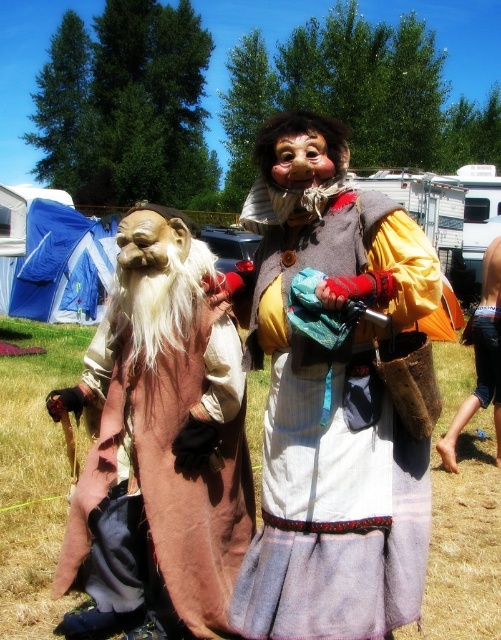
Is orange fabric pants at lower right further to the viewer compared to matte brown mask at center?

Yes, orange fabric pants at lower right is behind matte brown mask at center.

Which is below, orange fabric pants at lower right or matte brown mask at center?

orange fabric pants at lower right is below.

You are a GUI agent. You are given a task and a screenshot of the screen. Output one action in this format:
    pyautogui.click(x=<x>, y=<y>)
    Task: Click on the orange fabric pants at lower right
    This screenshot has height=640, width=501.
    Given the screenshot: What is the action you would take?
    pyautogui.click(x=480, y=358)

This screenshot has height=640, width=501. Find the location of `orange fabric pants at lower right`. orange fabric pants at lower right is located at coordinates (480, 358).

Looking at this image, can you confirm if worn fabric dress at center is positioned to the left of matte brown mask at center?

Incorrect, worn fabric dress at center is not on the left side of matte brown mask at center.

Between worn fabric dress at center and matte brown mask at center, which one appears on the right side from the viewer's perspective?

From the viewer's perspective, worn fabric dress at center appears more on the right side.

Where is `worn fabric dress at center`? This screenshot has height=640, width=501. worn fabric dress at center is located at coordinates tap(337, 436).

Does orange fabric pants at lower right have a greater width compared to matte brown mask at left?

Indeed, orange fabric pants at lower right has a greater width compared to matte brown mask at left.

Can you confirm if orange fabric pants at lower right is positioned to the left of matte brown mask at left?

In fact, orange fabric pants at lower right is to the right of matte brown mask at left.

Where is `orange fabric pants at lower right`? The height and width of the screenshot is (640, 501). orange fabric pants at lower right is located at coordinates (480, 358).

Find the location of `orange fabric pants at lower right`. orange fabric pants at lower right is located at coordinates (480, 358).